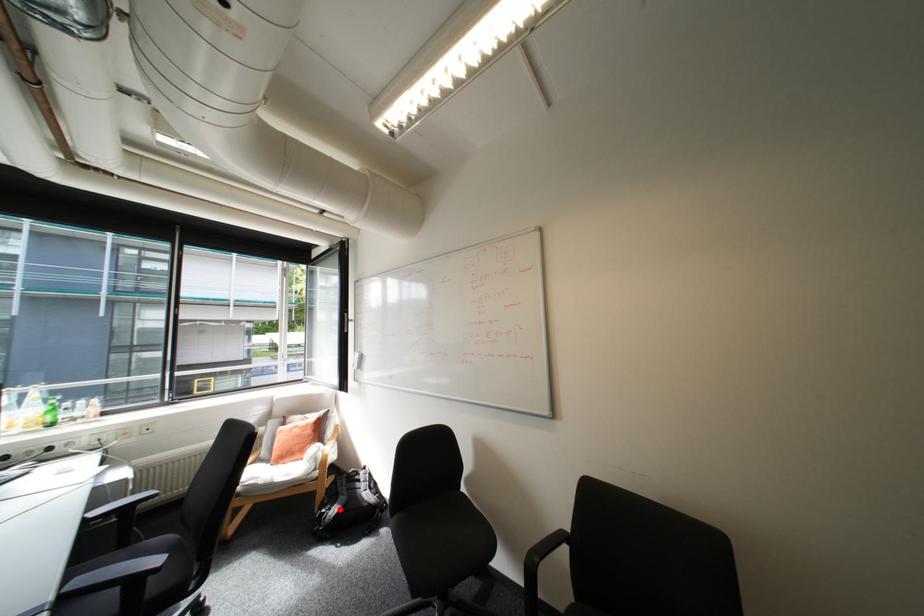
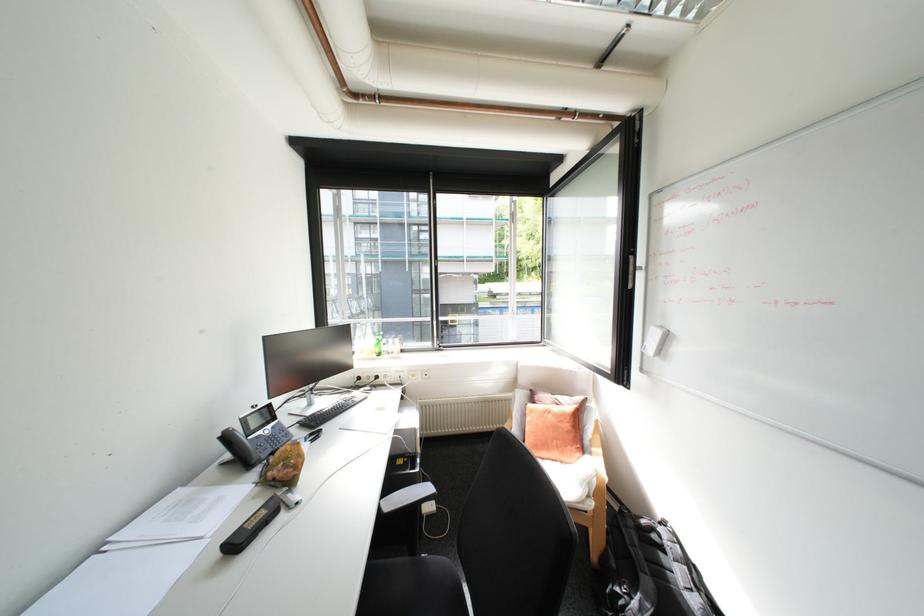
Question: I am providing you with two images of the same scene from different viewpoints. A red point is shown in image1. For the corresponding object point in image2, is it positioned nearer or farther from the camera?

Choices:
 (A) Nearer
 (B) Farther

Answer: (A)